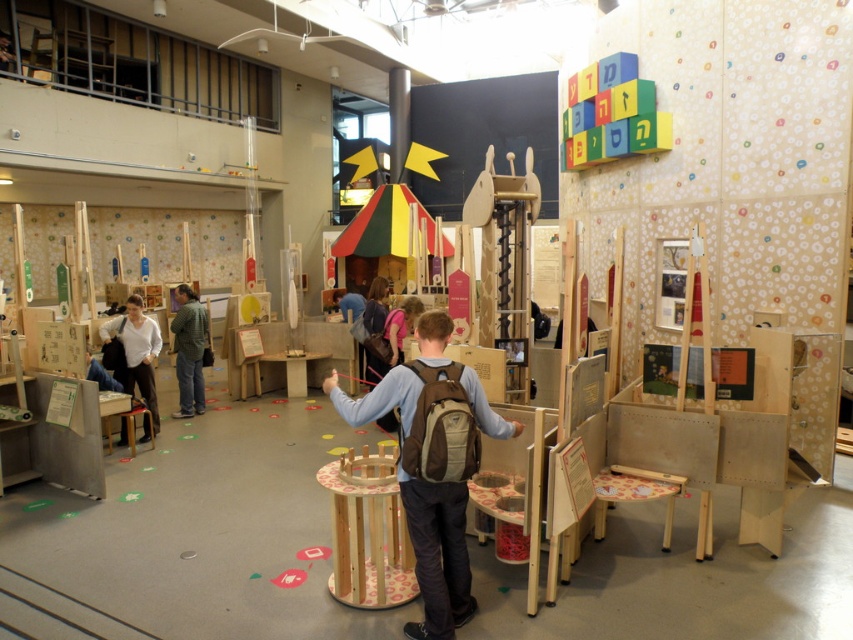
You are an assistant in the museum and need to place a small decorative item on the taller object between the matte white shirt at left and the green matte jacket at center. Which object should you choose?

The green matte jacket at center is taller than the matte white shirt at left, so you should place the decorative item on the green matte jacket at center.

You are a parent trying to decide which item to let your child play with. The multicolored wooden blocks at upper right and the green matte jacket at center are both in view. Based on their sizes, which item is more suitable for a child to handle?

The multicolored wooden blocks at upper right are larger in size than the green matte jacket at center, making them more suitable for a child to handle safely and comfortably.

You are a visitor in this museum exhibit and want to place the green matte jacket at center onto a display stand located to the left of the multicolored wooden blocks at upper right. Is the jacket currently positioned where you need it to be?

The multicolored wooden blocks at upper right is positioned on the right side of green matte jacket at center, meaning the jacket is already to the left of the blocks. Therefore, the green matte jacket at center is already in the correct position for placement onto the display stand located to the left of the blocks.